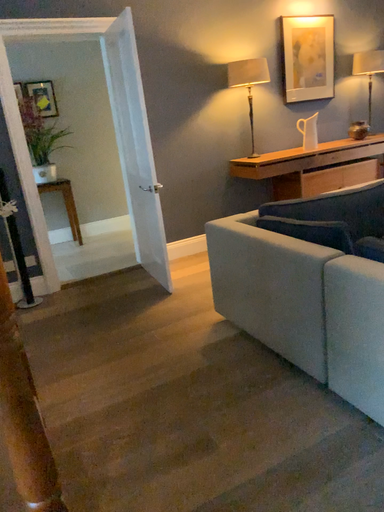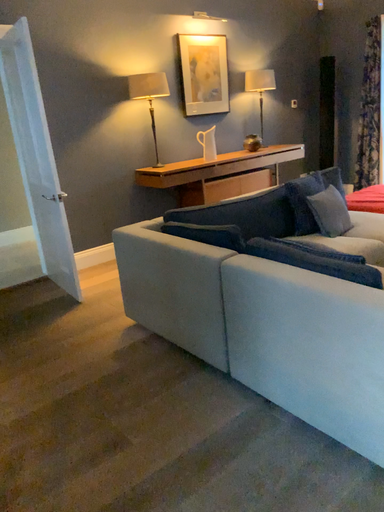
Question: How did the camera likely rotate when shooting the video?

Choices:
 (A) rotated right
 (B) rotated left

Answer: (A)